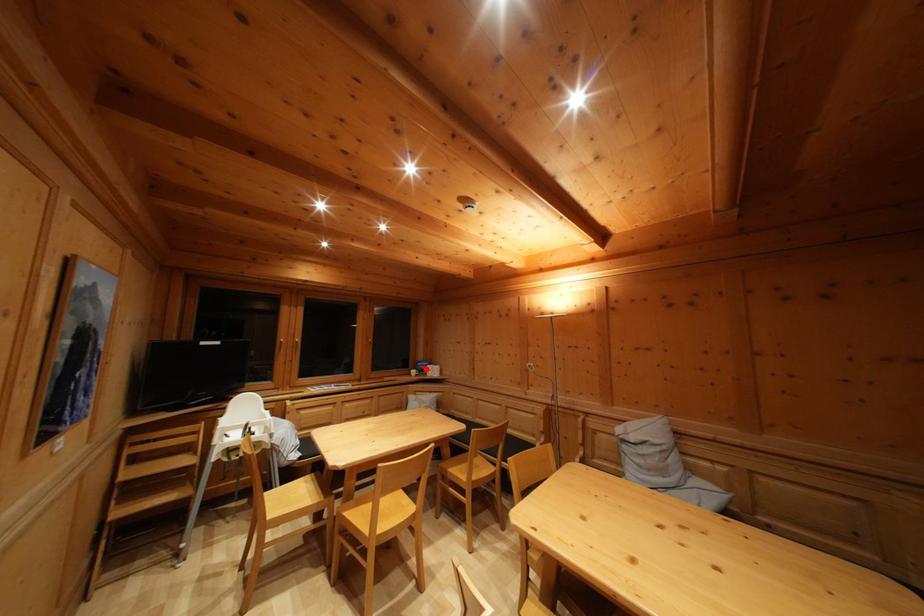
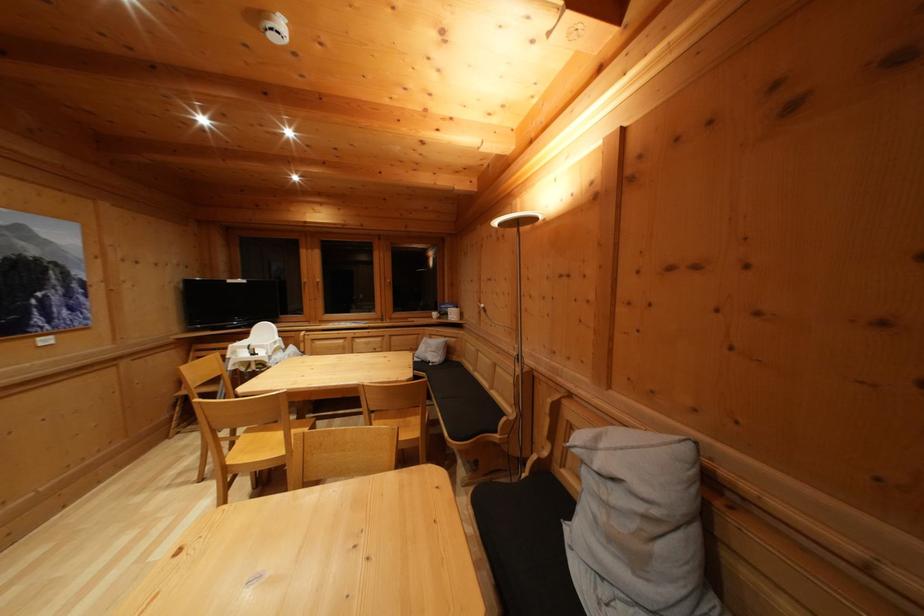
Question: I am providing you with two images of the same scene from different viewpoints. In image1, a red point is highlighted. Considering the same 3D point in image2, which of the following is correct?

Choices:
 (A) It is closer
 (B) It is farther

Answer: (A)